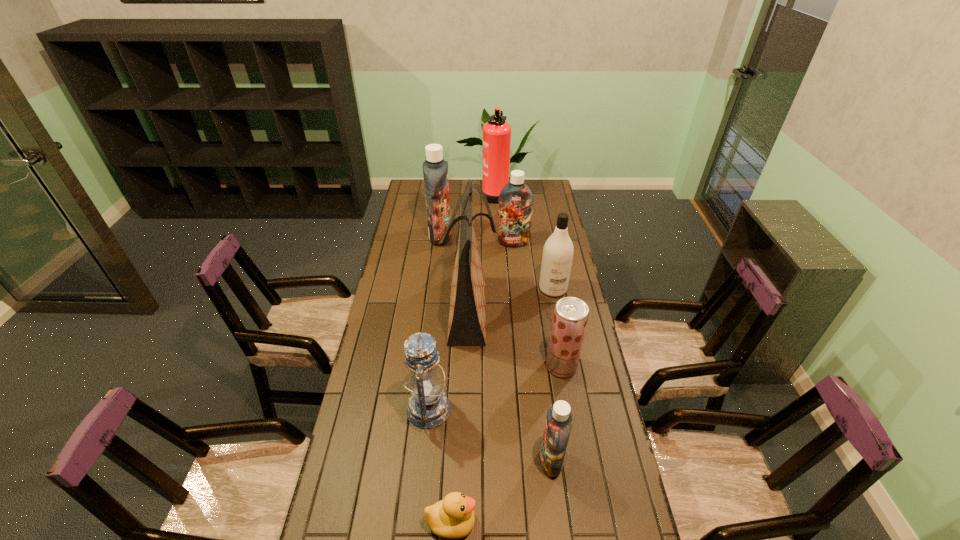
Locate an element on the screen. the sixth farthest object is located at coordinates (570, 317).

Find the location of a particular element. The width and height of the screenshot is (960, 540). the nearest shampoo is located at coordinates (558, 424).

The width and height of the screenshot is (960, 540). I want to click on the shortest shampoo, so click(x=558, y=424).

I want to click on vacant region located at the nozzle of the farthest object, so click(410, 193).

This screenshot has width=960, height=540. What are the coordinates of `vacant space located at the nozzle of the farthest object` in the screenshot? It's located at (432, 193).

The width and height of the screenshot is (960, 540). I want to click on free space located 0.380m at the nozzle of the farthest object, so click(412, 193).

Identify the location of free region located 0.340m on the front-facing side of the shopping bag. (583, 309).

The width and height of the screenshot is (960, 540). In order to click on vacant space situated on the front label of the leftmost blue shampoo in this screenshot , I will do `click(516, 236)`.

Locate an element on the screen. Image resolution: width=960 pixels, height=540 pixels. vacant space located on the front-facing side of the rightmost shampoo is located at coordinates (562, 334).

This screenshot has width=960, height=540. Identify the location of vacant space positioned on the front label of the second biggest blue shampoo. (517, 282).